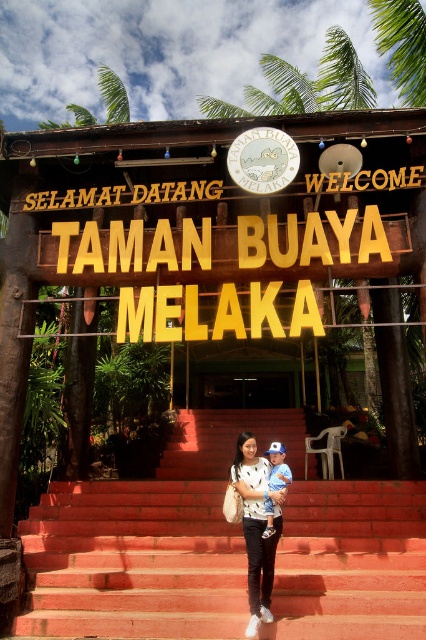
Who is shorter, white matte dress at center or blue cotton shirt at center?

With less height is blue cotton shirt at center.

Which is in front, point (261, 484) or point (267, 538)?

Point (267, 538) is more forward.

Where is `white matte dress at center`? The height and width of the screenshot is (640, 426). white matte dress at center is located at coordinates tap(256, 525).

Looking at this image, who is more distant from viewer, (x=176, y=509) or (x=267, y=536)?

Positioned behind is point (x=176, y=509).

Is red brick stairs at center wider than blue cotton shirt at center?

Yes.

The height and width of the screenshot is (640, 426). I want to click on red brick stairs at center, so click(x=149, y=540).

Does red brick stairs at center have a lesser height compared to white matte dress at center?

Indeed, red brick stairs at center has a lesser height compared to white matte dress at center.

Is red brick stairs at center smaller than white matte dress at center?

No, red brick stairs at center is not smaller than white matte dress at center.

Where is `red brick stairs at center`? The image size is (426, 640). red brick stairs at center is located at coordinates (149, 540).